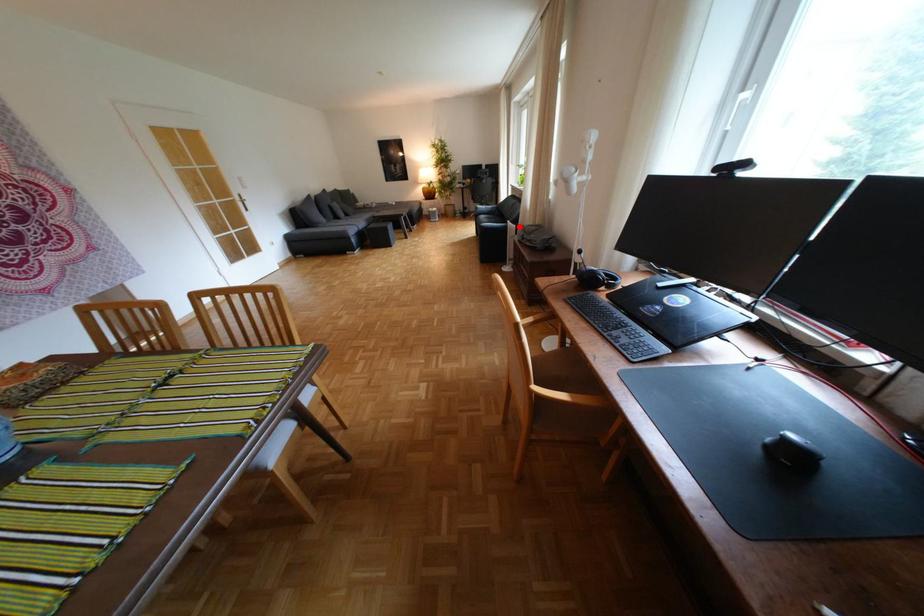
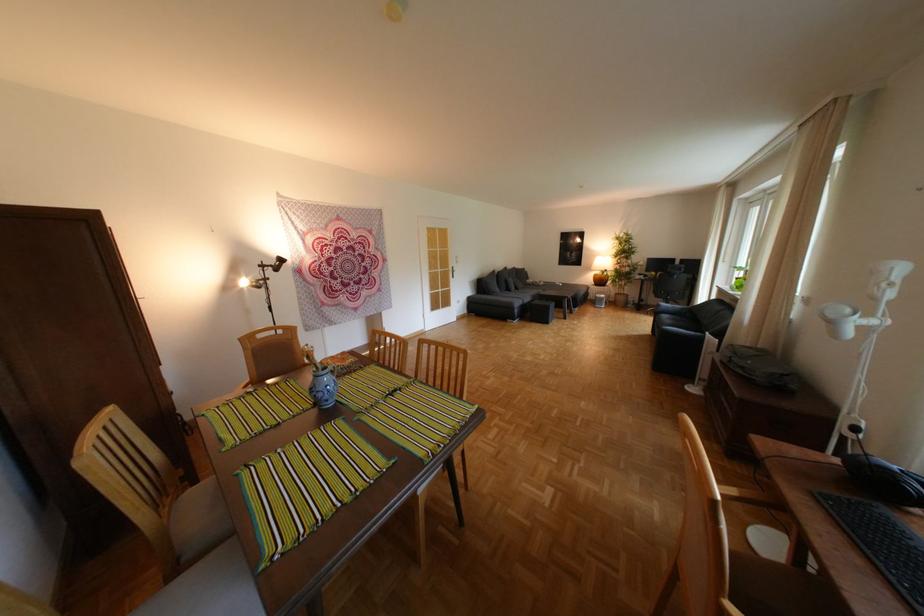
In the second image, find the point that corresponds to the highlighted location in the first image.

(715, 338)